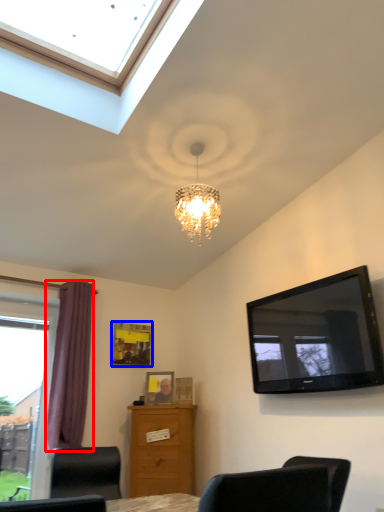
Question: Which object is closer to the camera taking this photo, curtain (highlighted by a red box) or picture frame (highlighted by a blue box)?

Choices:
 (A) curtain
 (B) picture frame

Answer: (A)